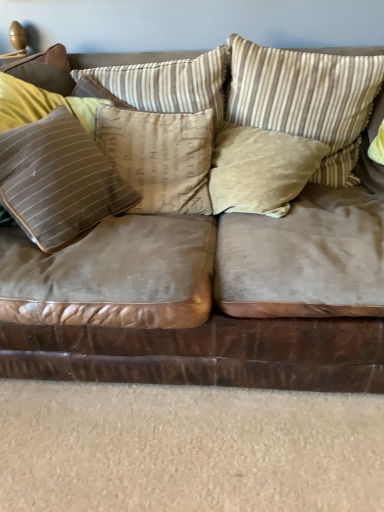
You are a GUI agent. You are given a task and a screenshot of the screen. Output one action in this format:
    pyautogui.click(x=<x>, y=<y>)
    Task: Click on the brown suede couch at center
    Image resolution: width=384 pixels, height=512 pixels.
    Given the screenshot: What is the action you would take?
    pyautogui.click(x=208, y=296)

This screenshot has height=512, width=384. Describe the element at coordinates (160, 157) in the screenshot. I see `brown striped cushion at center, which is the 3th pillow from right to left` at that location.

The image size is (384, 512). Identify the location of suede-like brown pillow at left, which ranks as the first pillow in left-to-right order. (58, 180).

The image size is (384, 512). Identify the location of brown suede couch at center. (208, 296).

Is brown suede couch at center in front of or behind brown striped pillow at upper right, the 5th pillow when ordered from left to right, in the image?

brown suede couch at center is positioned closer to the viewer than brown striped pillow at upper right, the 5th pillow when ordered from left to right.

Does brown suede couch at center have a lesser width compared to brown striped pillow at upper right, the 5th pillow when ordered from left to right?

In fact, brown suede couch at center might be wider than brown striped pillow at upper right, the 5th pillow when ordered from left to right.

Which of these two, brown suede couch at center or brown striped pillow at upper right, the 5th pillow when ordered from left to right, is bigger?

brown suede couch at center.

Can you see brown suede couch at center touching brown striped pillow at upper right, the 5th pillow when ordered from left to right?

brown suede couch at center and brown striped pillow at upper right, the 5th pillow when ordered from left to right, are clearly separated.

Which of these two, suede-like brown pillow at left, which appears as the fifth pillow when viewed from the right, or brown striped cushion at center, which is the 3th pillow from right to left, is wider?

brown striped cushion at center, which is the 3th pillow from right to left.

Between point (7, 179) and point (114, 140), which one is positioned behind?

The point (114, 140) is farther.

Is suede-like brown pillow at left, which ranks as the first pillow in left-to-right order, positioned beyond the bounds of brown striped cushion at center, which is the 3th pillow from right to left?

Yes, suede-like brown pillow at left, which ranks as the first pillow in left-to-right order, is not within brown striped cushion at center, which is the 3th pillow from right to left.

Consider the image. Between velvet beige pillow at center, which is counted as the fourth pillow, starting from the left, and suede-like brown pillow at left, which appears as the fifth pillow when viewed from the right, which one appears on the left side from the viewer's perspective?

suede-like brown pillow at left, which appears as the fifth pillow when viewed from the right.

Based on their sizes in the image, would you say velvet beige pillow at center, the second pillow in the right-to-left sequence, is bigger or smaller than suede-like brown pillow at left, which ranks as the first pillow in left-to-right order?

In the image, velvet beige pillow at center, the second pillow in the right-to-left sequence, appears to be smaller than suede-like brown pillow at left, which ranks as the first pillow in left-to-right order.

Is velvet beige pillow at center, which is counted as the fourth pillow, starting from the left, not inside suede-like brown pillow at left, which ranks as the first pillow in left-to-right order?

velvet beige pillow at center, which is counted as the fourth pillow, starting from the left, is positioned outside suede-like brown pillow at left, which ranks as the first pillow in left-to-right order.

Does point (287, 155) lie behind point (33, 185)?

That is True.

From a real-world perspective, between brown striped pillow at upper right, which is the 1th pillow from right to left, and suede-like brown pillow at left, which ranks as the first pillow in left-to-right order, who is vertically lower?

suede-like brown pillow at left, which ranks as the first pillow in left-to-right order, from a real-world perspective.

Is suede-like brown pillow at left, which appears as the fifth pillow when viewed from the right, surrounded by brown striped pillow at upper right, the 5th pillow when ordered from left to right?

No, suede-like brown pillow at left, which appears as the fifth pillow when viewed from the right, is not surrounded by brown striped pillow at upper right, the 5th pillow when ordered from left to right.

Based on the photo, which point is more forward, [355,75] or [43,195]?

Positioned in front is point [43,195].

Is brown suede couch at center at the back of velvet beige pillow at center, the second pillow in the right-to-left sequence?

Correct, velvet beige pillow at center, the second pillow in the right-to-left sequence, is looking away from brown suede couch at center.

Consider the image. Which is more to the right, velvet beige pillow at center, which is counted as the fourth pillow, starting from the left, or brown suede couch at center?

Positioned to the right is velvet beige pillow at center, which is counted as the fourth pillow, starting from the left.

Is point (289, 173) positioned before point (300, 358)?

That is False.

From a real-world perspective, is velvet beige pillow at center, which is counted as the fourth pillow, starting from the left, physically below brown suede couch at center?

No, from a real-world perspective, velvet beige pillow at center, which is counted as the fourth pillow, starting from the left, is not under brown suede couch at center.

At what (x,y) coordinates should I click in order to perform the action: click on the 1st pillow behind the brown suede couch at center, starting your count from the anchor. Please return your answer as a coordinate pair (x, y). Looking at the image, I should click on (58, 180).

Can brown suede couch at center be found inside suede-like brown pillow at left, which appears as the fifth pillow when viewed from the right?

No.

In the image, is suede-like brown pillow at left, which appears as the fifth pillow when viewed from the right, positioned in front of or behind brown suede couch at center?

Clearly, suede-like brown pillow at left, which appears as the fifth pillow when viewed from the right, is behind brown suede couch at center.

Locate an element on the screen. The height and width of the screenshot is (512, 384). the 3rd pillow located above the brown suede couch at center (from a real-world perspective) is located at coordinates (58, 180).

Is brown suede couch at center oriented away from suede-like brown pillow at left, which appears as the fifth pillow when viewed from the right?

Yes, suede-like brown pillow at left, which appears as the fifth pillow when viewed from the right, is at the back of brown suede couch at center.

From the image's perspective, is brown suede couch at center beneath suede-like brown pillow at left, which appears as the fifth pillow when viewed from the right?

Correct, brown suede couch at center appears lower than suede-like brown pillow at left, which appears as the fifth pillow when viewed from the right, in the image.

Does brown suede couch at center have a lesser height compared to suede-like brown pillow at left, which ranks as the first pillow in left-to-right order?

No.

Find the location of a particular element. The width and height of the screenshot is (384, 512). pillow that is the 4th object located behind the brown suede couch at center is located at coordinates (306, 98).

The height and width of the screenshot is (512, 384). I want to click on the 1st pillow located beneath the suede-like brown pillow at left, which appears as the fifth pillow when viewed from the right (from a real-world perspective), so click(160, 157).

When comparing their distances from brown striped cushion at center, which is the 3th pillow from right to left, does velvet beige pillow at center, the second pillow in the right-to-left sequence, or brown striped pillow at upper right, which is the 1th pillow from right to left, seem closer?

Based on the image, velvet beige pillow at center, the second pillow in the right-to-left sequence, appears to be nearer to brown striped cushion at center, which is the 3th pillow from right to left.

Estimate the real-world distances between objects in this image. Which object is further from brown striped pillow at center, the second pillow viewed from the left, velvet beige pillow at center, the second pillow in the right-to-left sequence, or brown suede couch at center?

brown suede couch at center.

Which object lies nearer to the anchor point brown striped pillow at upper right, the 5th pillow when ordered from left to right, suede-like brown pillow at left, which ranks as the first pillow in left-to-right order, or velvet beige pillow at center, the second pillow in the right-to-left sequence?

The object closer to brown striped pillow at upper right, the 5th pillow when ordered from left to right, is velvet beige pillow at center, the second pillow in the right-to-left sequence.

Based on the photo, when comparing their distances from brown striped pillow at upper right, the 5th pillow when ordered from left to right, does brown striped pillow at center, the fourth pillow viewed from the right, or brown suede couch at center seem further?

The object further to brown striped pillow at upper right, the 5th pillow when ordered from left to right, is brown suede couch at center.

Looking at the image, which one is located closer to velvet beige pillow at center, which is counted as the fourth pillow, starting from the left, brown suede couch at center or brown striped cushion at center, which is the 3th pillow from right to left?

brown striped cushion at center, which is the 3th pillow from right to left, is closer to velvet beige pillow at center, which is counted as the fourth pillow, starting from the left.

Looking at the image, which one is located further to brown striped cushion at center, which is the 3th pillow from right to left, velvet beige pillow at center, which is counted as the fourth pillow, starting from the left, or suede-like brown pillow at left, which appears as the fifth pillow when viewed from the right?

suede-like brown pillow at left, which appears as the fifth pillow when viewed from the right, is positioned further to the anchor brown striped cushion at center, which is the 3th pillow from right to left.

Which object lies nearer to the anchor point brown suede couch at center, suede-like brown pillow at left, which appears as the fifth pillow when viewed from the right, or brown striped pillow at upper right, the 5th pillow when ordered from left to right?

suede-like brown pillow at left, which appears as the fifth pillow when viewed from the right, is closer to brown suede couch at center.

Estimate the real-world distances between objects in this image. Which object is further from suede-like brown pillow at left, which ranks as the first pillow in left-to-right order, velvet beige pillow at center, the second pillow in the right-to-left sequence, or brown striped pillow at upper right, which is the 1th pillow from right to left?

Based on the image, brown striped pillow at upper right, which is the 1th pillow from right to left, appears to be further to suede-like brown pillow at left, which ranks as the first pillow in left-to-right order.

I want to click on pillow between brown striped cushion at center, the 3th pillow positioned from the left, and brown striped pillow at upper right, the 5th pillow when ordered from left to right, in the horizontal direction, so click(x=260, y=169).

Where is `studio couch situated between suede-like brown pillow at left, which ranks as the first pillow in left-to-right order, and velvet beige pillow at center, which is counted as the fourth pillow, starting from the left, from left to right`? Image resolution: width=384 pixels, height=512 pixels. studio couch situated between suede-like brown pillow at left, which ranks as the first pillow in left-to-right order, and velvet beige pillow at center, which is counted as the fourth pillow, starting from the left, from left to right is located at coordinates (208, 296).

Where is `studio couch between suede-like brown pillow at left, which appears as the fifth pillow when viewed from the right, and brown striped pillow at upper right, the 5th pillow when ordered from left to right, in the horizontal direction`? This screenshot has width=384, height=512. studio couch between suede-like brown pillow at left, which appears as the fifth pillow when viewed from the right, and brown striped pillow at upper right, the 5th pillow when ordered from left to right, in the horizontal direction is located at coordinates (208, 296).

At what (x,y) coordinates should I click in order to perform the action: click on pillow between brown striped pillow at center, the fourth pillow viewed from the right, and velvet beige pillow at center, the second pillow in the right-to-left sequence, in the horizontal direction. Please return your answer as a coordinate pair (x, y). The image size is (384, 512). Looking at the image, I should click on (160, 157).